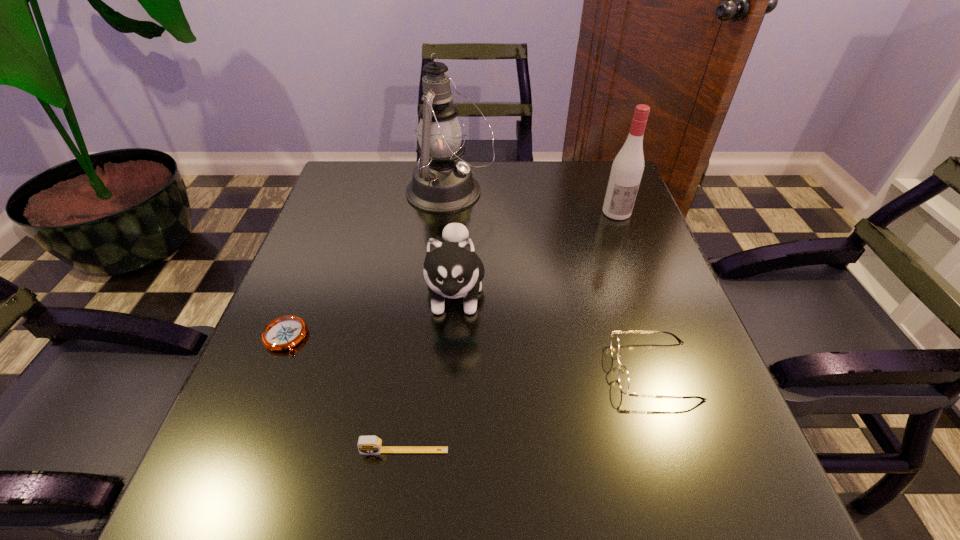
This screenshot has width=960, height=540. I want to click on vacant space that is in between the nearest object and the shortest object, so click(345, 394).

Where is `free spot between the nearest object and the third tallest object`? The height and width of the screenshot is (540, 960). free spot between the nearest object and the third tallest object is located at coordinates (430, 372).

This screenshot has width=960, height=540. I want to click on free space between the second tallest object and the fourth tallest object, so click(636, 292).

Locate an element on the screen. This screenshot has width=960, height=540. vacant point located between the compass and the fourth shortest object is located at coordinates (371, 315).

Where is `free point between the fifth shortest object and the second shortest object`? free point between the fifth shortest object and the second shortest object is located at coordinates (511, 332).

Where is `vacant region between the tallest object and the nearest object`? vacant region between the tallest object and the nearest object is located at coordinates (427, 321).

Locate an element on the screen. The image size is (960, 540). free spot between the fourth tallest object and the leftmost object is located at coordinates (469, 354).

Identify the location of object that is the nearest to the nearest object. (452, 269).

Identify which object is the third closest to the alcohol. Please provide its 2D coordinates. Your answer should be formatted as a tuple, i.e. [(x, y)], where the tuple contains the x and y coordinates of a point satisfying the conditions above.

[(623, 376)]